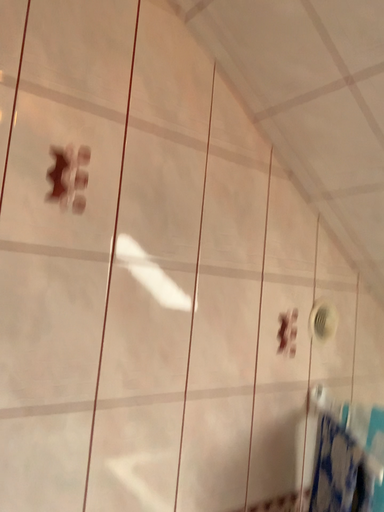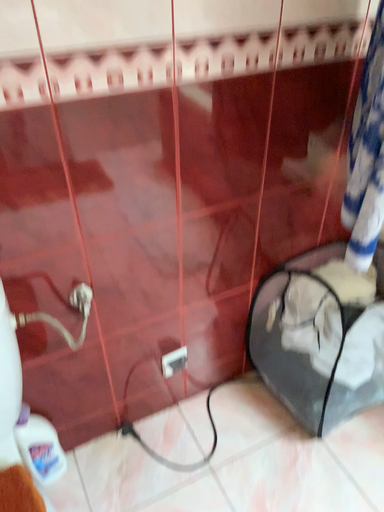
Question: Which way did the camera rotate in the video?

Choices:
 (A) rotated upward
 (B) rotated downward

Answer: (B)